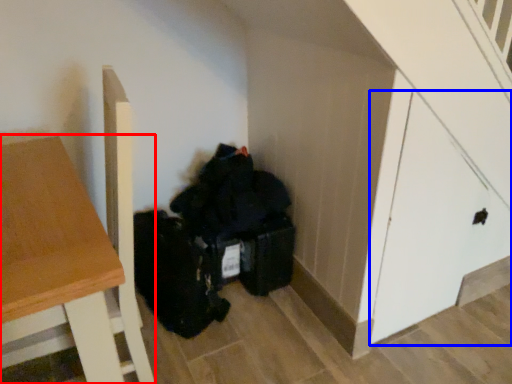
Question: Among these objects, which one is nearest to the camera, table (highlighted by a red box) or door (highlighted by a blue box)?

Choices:
 (A) table
 (B) door

Answer: (A)